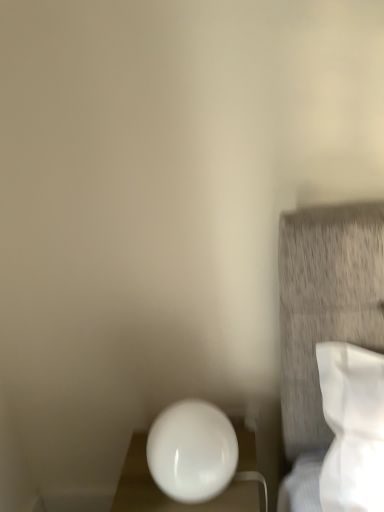
Question: Is point (190, 475) closer or farther from the camera than point (248, 445)?

Choices:
 (A) farther
 (B) closer

Answer: (B)

Question: Is white glossy sphere at lower left in front of or behind white glossy sphere at lower center in the image?

Choices:
 (A) front
 (B) behind

Answer: (A)

Question: From a real-world perspective, is white glossy sphere at lower left positioned above or below white glossy sphere at lower center?

Choices:
 (A) below
 (B) above

Answer: (B)

Question: Considering the positions of white glossy sphere at lower center and white glossy sphere at lower left in the image, is white glossy sphere at lower center wider or thinner than white glossy sphere at lower left?

Choices:
 (A) thin
 (B) wide

Answer: (B)

Question: From a real-world perspective, is white glossy sphere at lower center physically located above or below white glossy sphere at lower left?

Choices:
 (A) below
 (B) above

Answer: (A)

Question: Based on their sizes in the image, would you say white glossy sphere at lower center is bigger or smaller than white glossy sphere at lower left?

Choices:
 (A) small
 (B) big

Answer: (B)

Question: Is white glossy sphere at lower center inside the boundaries of white glossy sphere at lower left, or outside?

Choices:
 (A) inside
 (B) outside

Answer: (B)